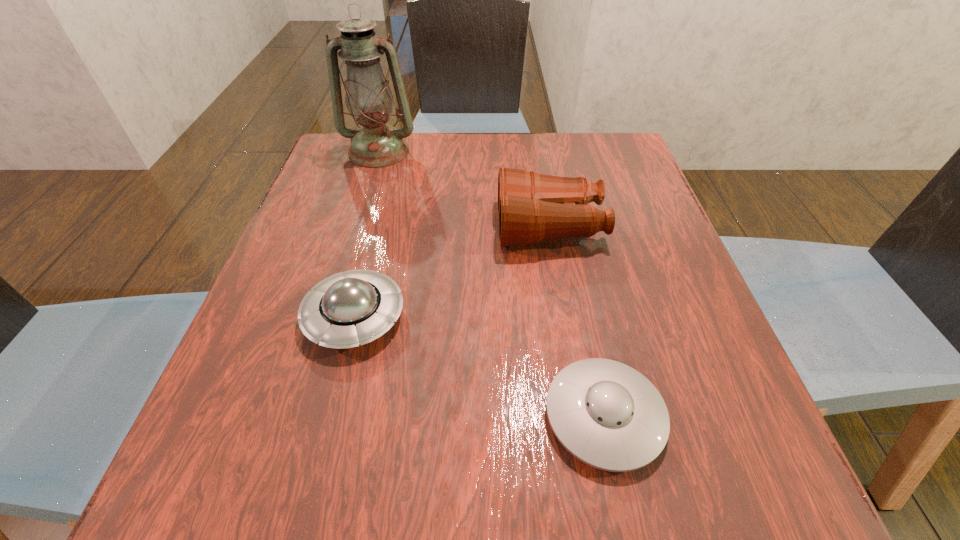
Image resolution: width=960 pixels, height=540 pixels. Identify the location of object at the far left corner. (369, 100).

Locate an element on the screen. object at the near right corner is located at coordinates (605, 413).

In the image, there is a desktop. Where is `free space at the far edge`? free space at the far edge is located at coordinates (504, 166).

Identify the location of vacant space at the near edge of the desktop. (557, 470).

Locate an element on the screen. The height and width of the screenshot is (540, 960). free point at the left edge is located at coordinates (250, 439).

Where is `free space at the right edge of the desktop`? free space at the right edge of the desktop is located at coordinates (631, 328).

Locate an element on the screen. The width and height of the screenshot is (960, 540). vacant space at the far right corner of the desktop is located at coordinates (636, 181).

This screenshot has width=960, height=540. What are the coordinates of `vacant point located between the second farthest object and the farther saucer` in the screenshot? It's located at (452, 272).

The height and width of the screenshot is (540, 960). I want to click on vacant space that's between the shorter saucer and the tallest object, so click(492, 284).

At what (x,y) coordinates should I click in order to perform the action: click on free spot between the third nearest object and the third tallest object. Please return your answer as a coordinate pair (x, y). This screenshot has width=960, height=540. Looking at the image, I should click on (452, 272).